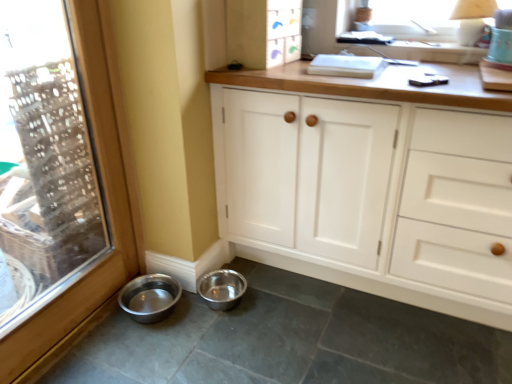
Locate an element on the screen. free space in front of white wood cabinet at upper center, which ranks as the 1th cabinetry in top-to-bottom order is located at coordinates tap(268, 66).